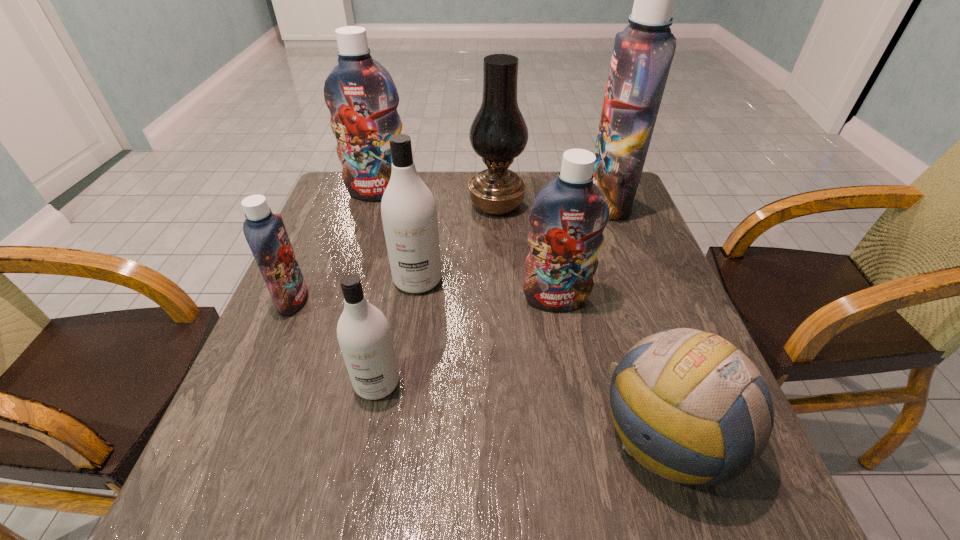
You are a GUI agent. You are given a task and a screenshot of the screen. Output one action in this format:
    pyautogui.click(x=<x>, y=<y>)
    Task: Click on the rightmost shampoo
    The width and height of the screenshot is (960, 540).
    Given the screenshot: What is the action you would take?
    pyautogui.click(x=642, y=55)

Locate an element on the screen. The height and width of the screenshot is (540, 960). the rightmost blue shampoo is located at coordinates (642, 55).

Locate an element on the screen. The image size is (960, 540). the second biggest blue shampoo is located at coordinates (360, 93).

Locate an element on the screen. brown oil lamp is located at coordinates [498, 133].

You are a GUI agent. You are given a task and a screenshot of the screen. Output one action in this format:
    pyautogui.click(x=<x>, y=<y>)
    Task: Click on the bigger white shampoo
    The height and width of the screenshot is (540, 960).
    Given the screenshot: What is the action you would take?
    pyautogui.click(x=408, y=209)

The height and width of the screenshot is (540, 960). What are the coordinates of `the fifth shampoo from left to right` in the screenshot? It's located at (568, 216).

The width and height of the screenshot is (960, 540). I want to click on the second blue shampoo from right to left, so click(x=568, y=216).

Locate an element on the screen. the smallest blue shampoo is located at coordinates (265, 232).

I want to click on the smaller white shampoo, so click(x=363, y=332).

Image resolution: width=960 pixels, height=540 pixels. I want to click on the nearest shampoo, so click(x=363, y=332).